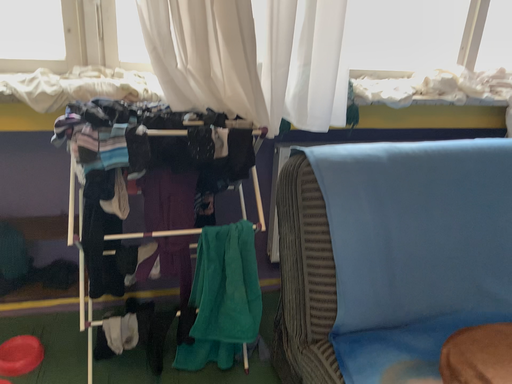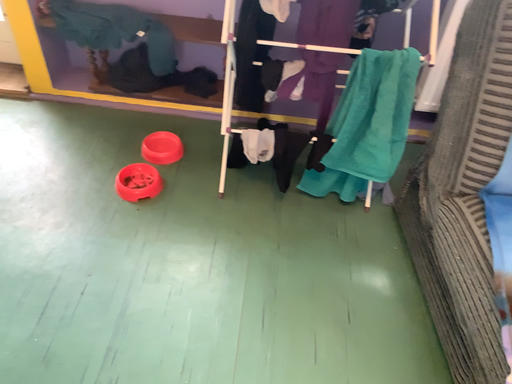
Question: How did the camera likely rotate when shooting the video?

Choices:
 (A) rotated upward
 (B) rotated downward

Answer: (B)